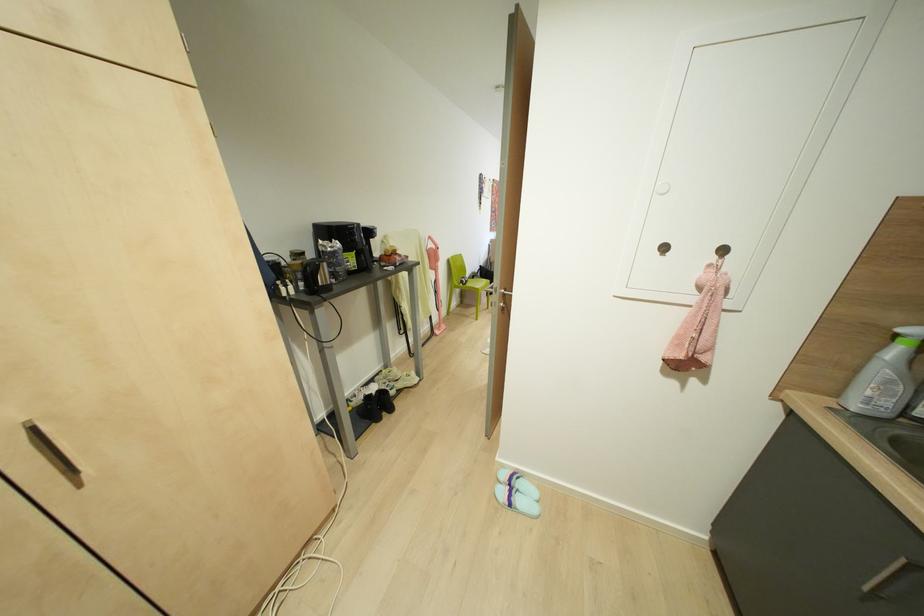
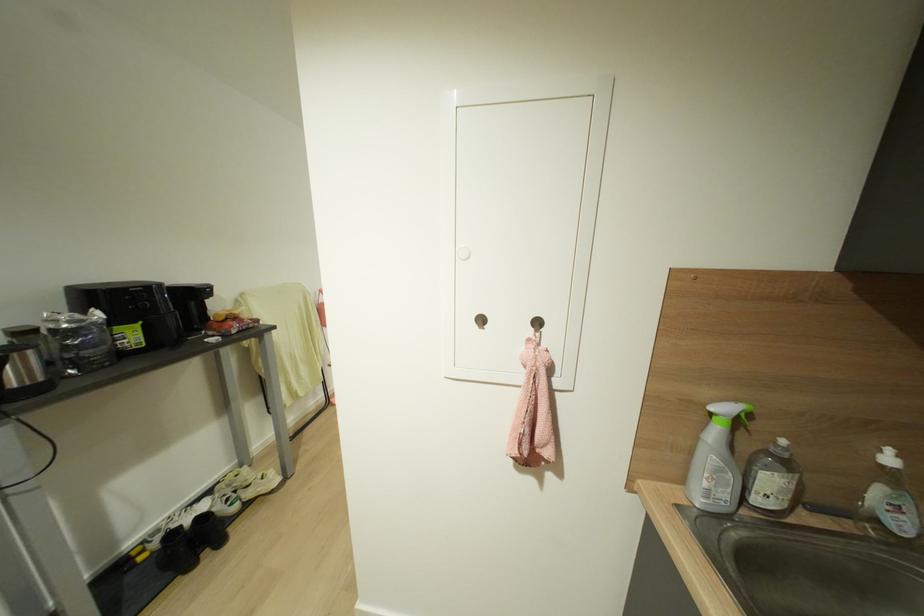
Which direction would the cameraman need to move to produce the second image?

The cameraman walked toward right, forward.